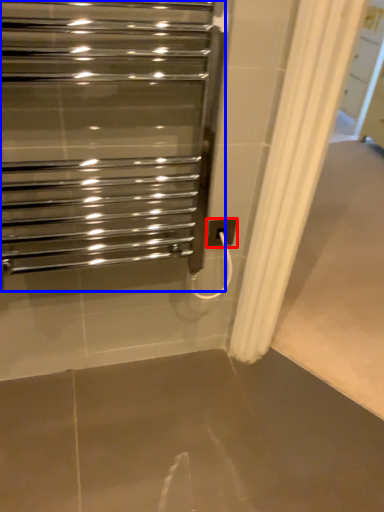
Question: Which point is closer to the camera, electric outlet (highlighted by a red box) or home appliance (highlighted by a blue box)?

Choices:
 (A) electric outlet
 (B) home appliance

Answer: (B)